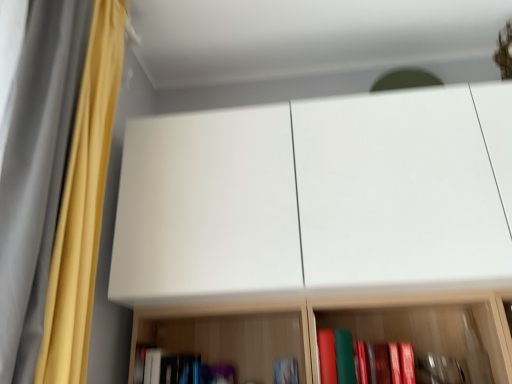
Question: Does point (161, 350) appear closer or farther from the camera than point (93, 284)?

Choices:
 (A) closer
 (B) farther

Answer: (B)

Question: In terms of height, does hardcover book at lower center, acting as the second book starting from the right, look taller or shorter compared to yellow fabric curtain at left, which is the 2th curtain in front-to-back order?

Choices:
 (A) tall
 (B) short

Answer: (B)

Question: Considering the real-world distances, which object is farthest from the yellow fabric curtain at left, positioned as the 1th curtain in back-to-front order?

Choices:
 (A) silky yellow curtain at left, which is the 2th curtain from back to front
 (B) hardcover book at lower center, the 2th book viewed from the left
 (C) hardcover book at lower center, acting as the second book starting from the right
 (D) white matte cabinet at upper center

Answer: (B)

Question: Estimate the real-world distances between objects in this image. Which object is farther from the hardcover book at lower center, acting as the second book starting from the right?

Choices:
 (A) white matte cabinet at upper center
 (B) hardcover book at lower center, the 2th book viewed from the left
 (C) silky yellow curtain at left, which is the 2th curtain from back to front
 (D) yellow fabric curtain at left, which is the 2th curtain in front-to-back order

Answer: (C)